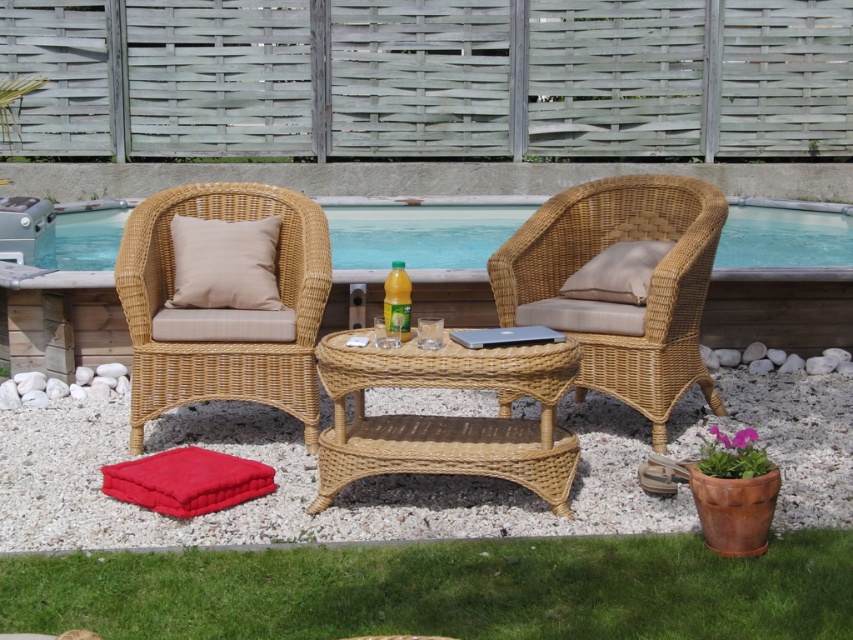
Between natural wicker armchair at center and velvet red cushion at lower left, which one appears on the right side from the viewer's perspective?

Positioned to the right is natural wicker armchair at center.

Is natural wicker armchair at center to the right of velvet red cushion at lower left from the viewer's perspective?

Indeed, natural wicker armchair at center is positioned on the right side of velvet red cushion at lower left.

You are a GUI agent. You are given a task and a screenshot of the screen. Output one action in this format:
    pyautogui.click(x=<x>, y=<y>)
    Task: Click on the natural wicker armchair at center
    This screenshot has width=853, height=640.
    Given the screenshot: What is the action you would take?
    pyautogui.click(x=653, y=282)

Locate an element on the screen. This screenshot has width=853, height=640. natural wicker armchair at center is located at coordinates (653, 282).

Which of these two, beige fabric cushion at left or velvet red cushion at lower left, stands shorter?

velvet red cushion at lower left is shorter.

Between beige fabric cushion at left and velvet red cushion at lower left, which one is positioned lower?

Positioned lower is velvet red cushion at lower left.

Identify the location of beige fabric cushion at left. (224, 262).

Locate an element on the screen. Image resolution: width=853 pixels, height=640 pixels. beige fabric cushion at left is located at coordinates (224, 262).

Who is more forward, (x=109, y=205) or (x=149, y=502)?

Point (x=149, y=502) is in front.

Is transparent blue water at center positioned in front of velvet red cushion at lower left?

No, transparent blue water at center is behind velvet red cushion at lower left.

What are the coordinates of `transparent blue water at center` in the screenshot? It's located at (421, 234).